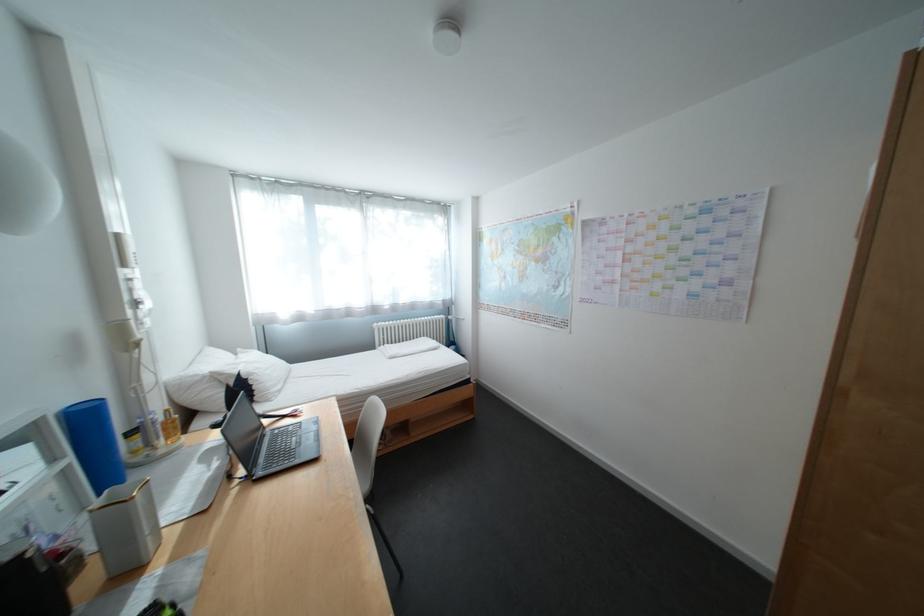
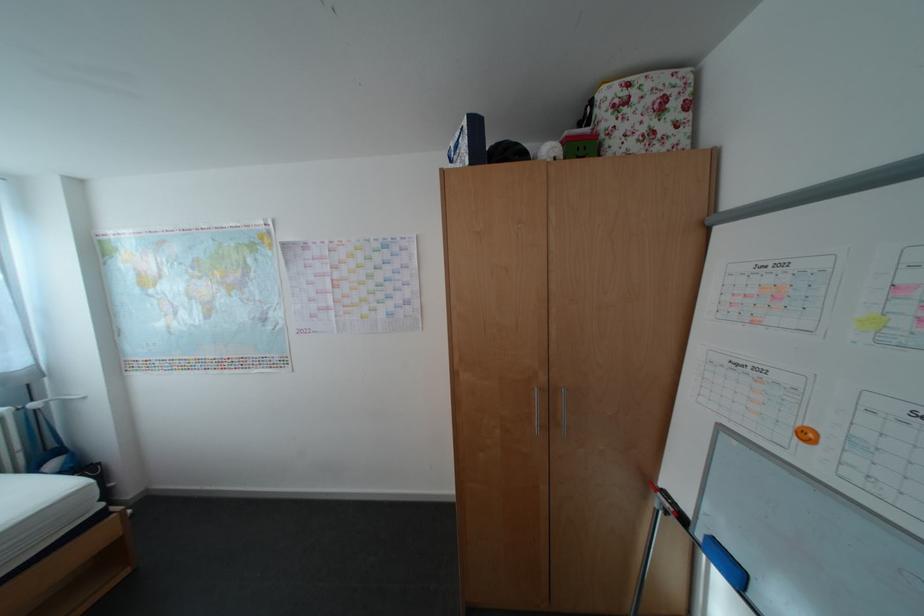
Where in the second image is the point corresponding to point (465, 341) from the first image?

(67, 447)